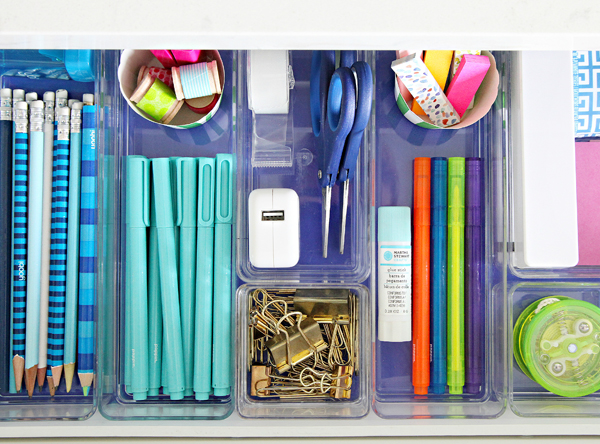
At what (x,y) coordinates should I click in order to perform the action: click on pen caps. Please return your answer as a coordinate pair (x, y). The height and width of the screenshot is (444, 600). Looking at the image, I should click on (135, 193), (158, 188), (173, 166), (184, 183), (203, 188), (221, 188), (475, 197), (456, 194), (444, 199), (417, 204).